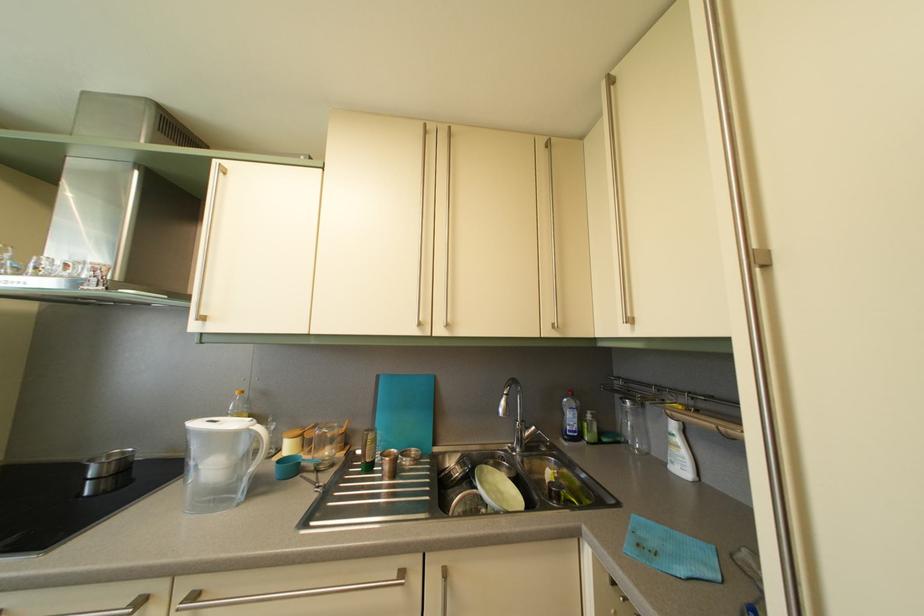
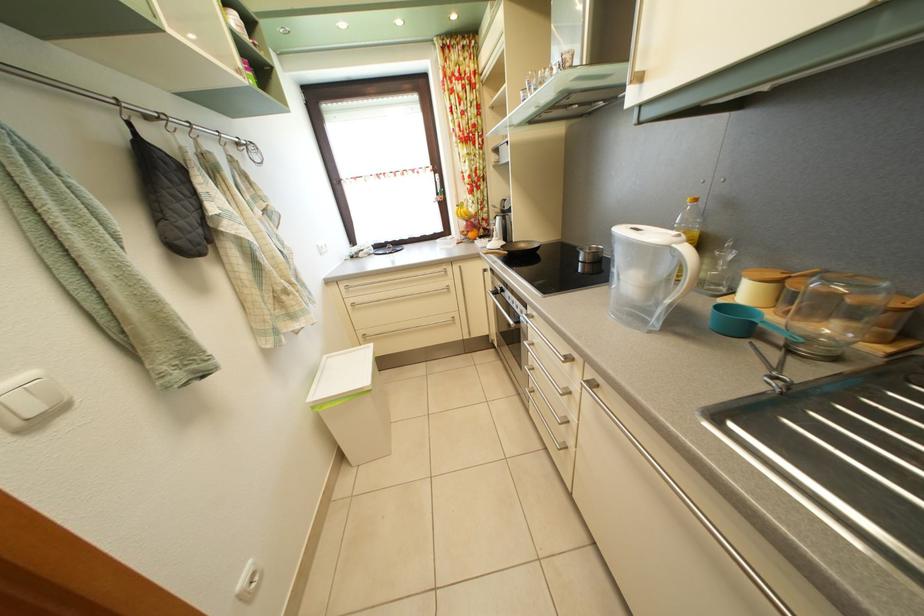
First-person continuous shooting, in which direction is the camera rotating?

The camera rotated toward left-down.